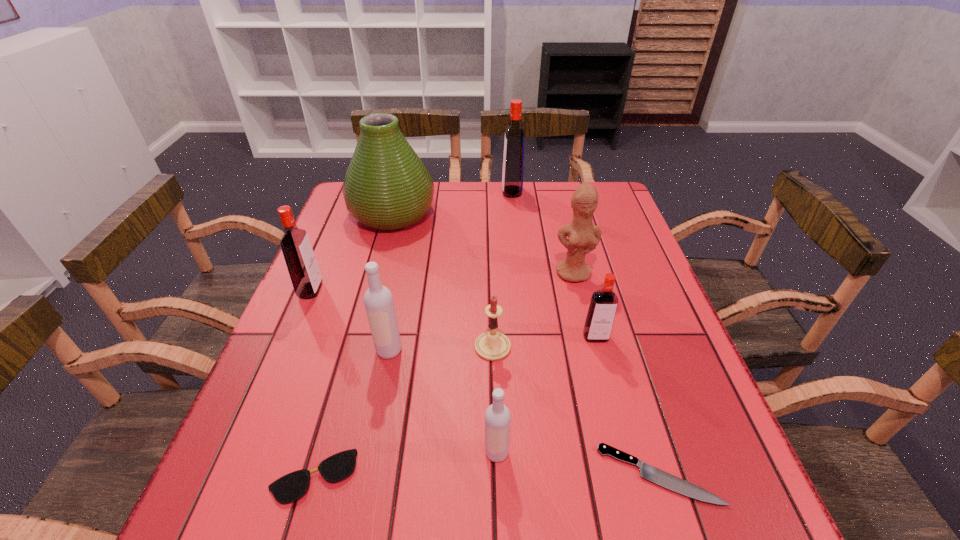
You are a GUI agent. You are given a task and a screenshot of the screen. Output one action in this format:
    pyautogui.click(x=<x>, y=<y>)
    Task: Click on the fourth object from right to left
    
    Given the screenshot: What is the action you would take?
    pyautogui.click(x=513, y=160)

Locate an element on the screen. the fourth vodka from left to right is located at coordinates (513, 160).

Find the location of a particular element. The image size is (960, 540). vase is located at coordinates (386, 187).

This screenshot has height=540, width=960. I want to click on figurine, so click(583, 236).

Locate an element on the screen. the second vodka from left to right is located at coordinates click(x=378, y=299).

Image resolution: width=960 pixels, height=540 pixels. Find the location of `the bigger white vodka`. the bigger white vodka is located at coordinates (378, 299).

This screenshot has height=540, width=960. Identify the location of the second farthest vodka. (302, 265).

At what (x,y) coordinates should I click in order to perform the action: click on the leftmost red vodka. Please return your answer as a coordinate pair (x, y). This screenshot has width=960, height=540. Looking at the image, I should click on (302, 265).

I want to click on the rightmost red vodka, so (601, 313).

Where is `the rightmost vodka`? This screenshot has width=960, height=540. the rightmost vodka is located at coordinates (601, 313).